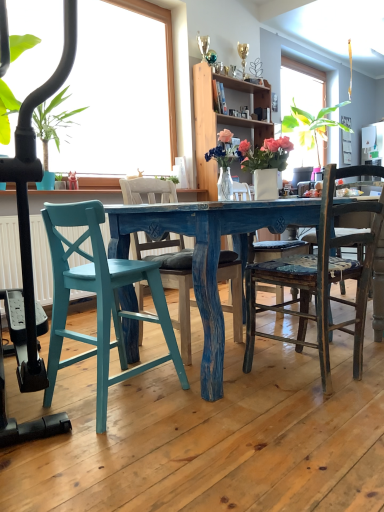
Question: Is blue painted wood chair at center, the 2th chair viewed from the right, facing away from distressed wood chair at center, which is the 1th chair in right-to-left order?

Choices:
 (A) yes
 (B) no

Answer: (B)

Question: Does blue painted wood chair at center, the 2th chair viewed from the right, appear on the right side of distressed wood chair at center, which is the 1th chair in right-to-left order?

Choices:
 (A) yes
 (B) no

Answer: (B)

Question: Is distressed wood chair at center, which is the 3th chair in left-to-right order, completely or partially inside blue painted wood chair at center, the 2th chair viewed from the right?

Choices:
 (A) yes
 (B) no

Answer: (B)

Question: Does blue painted wood chair at center, positioned as the 2th chair in left-to-right order, have a lesser height compared to distressed wood chair at center, which is the 3th chair in left-to-right order?

Choices:
 (A) yes
 (B) no

Answer: (B)

Question: Does blue painted wood chair at center, the 2th chair viewed from the right, appear on the left side of distressed wood chair at center, which is the 1th chair in right-to-left order?

Choices:
 (A) no
 (B) yes

Answer: (B)

Question: From the image's perspective, does blue painted wood chair at center, the 2th chair viewed from the right, appear lower than distressed wood chair at center, which is the 3th chair in left-to-right order?

Choices:
 (A) yes
 (B) no

Answer: (B)

Question: Can you confirm if wooden cabinet at upper center is wider than green leafy plant at left?

Choices:
 (A) no
 (B) yes

Answer: (A)

Question: Considering the relative positions of wooden cabinet at upper center and green leafy plant at left in the image provided, is wooden cabinet at upper center to the left of green leafy plant at left from the viewer's perspective?

Choices:
 (A) yes
 (B) no

Answer: (B)

Question: From the image's perspective, would you say wooden cabinet at upper center is positioned over green leafy plant at left?

Choices:
 (A) yes
 (B) no

Answer: (A)

Question: Considering the relative sizes of wooden cabinet at upper center and green leafy plant at left in the image provided, is wooden cabinet at upper center shorter than green leafy plant at left?

Choices:
 (A) no
 (B) yes

Answer: (A)

Question: Is wooden cabinet at upper center closer to camera compared to green leafy plant at left?

Choices:
 (A) no
 (B) yes

Answer: (A)

Question: Is wooden cabinet at upper center facing towards green leafy plant at left?

Choices:
 (A) no
 (B) yes

Answer: (A)

Question: Can you confirm if teal painted wood chair at lower left, which ranks as the third chair in right-to-left order, is bigger than wooden cabinet at upper center?

Choices:
 (A) yes
 (B) no

Answer: (B)